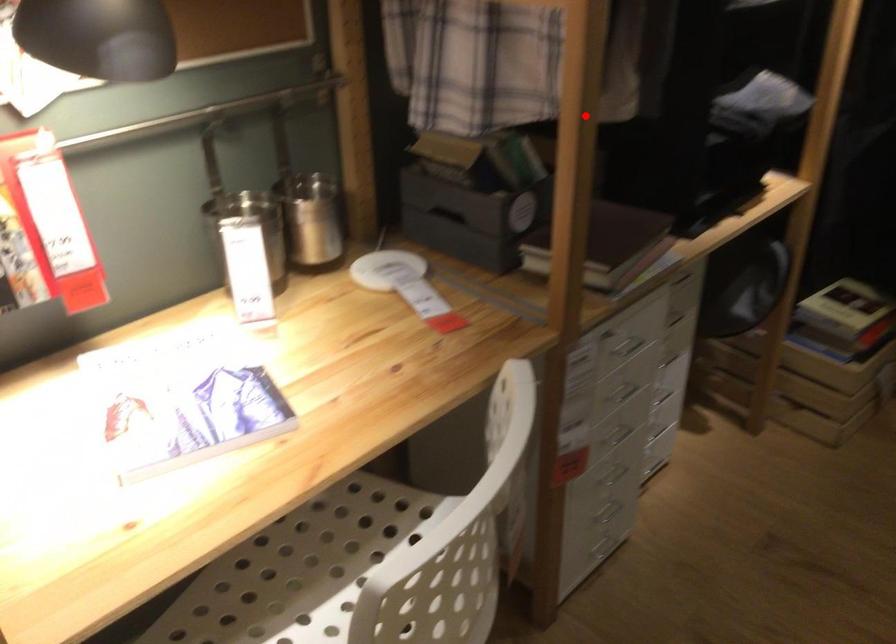
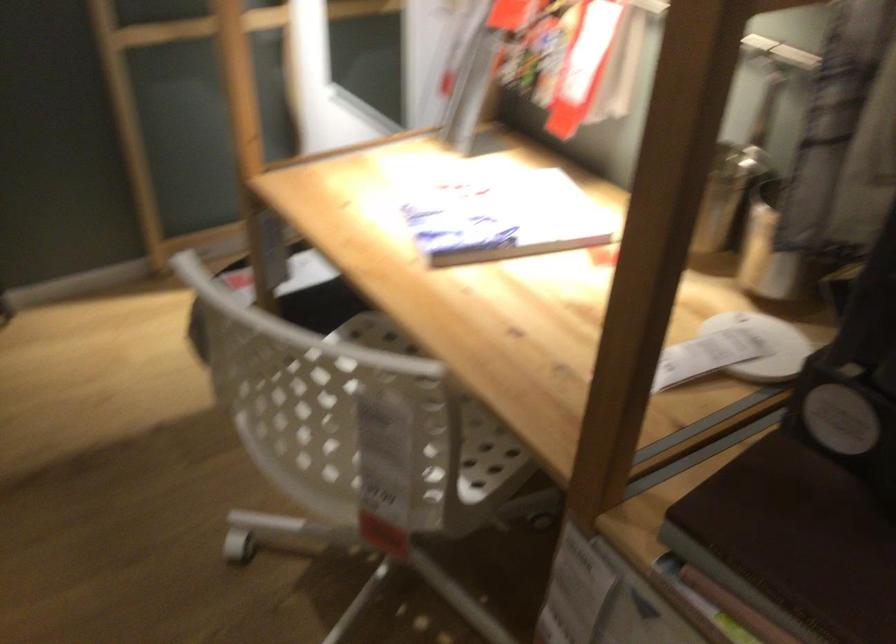
Question: I am providing you with two images of the same scene from different viewpoints. In image1, a red point is highlighted. Considering the same 3D point in image2, which of the following is correct?

Choices:
 (A) It is closer
 (B) It is farther

Answer: (A)